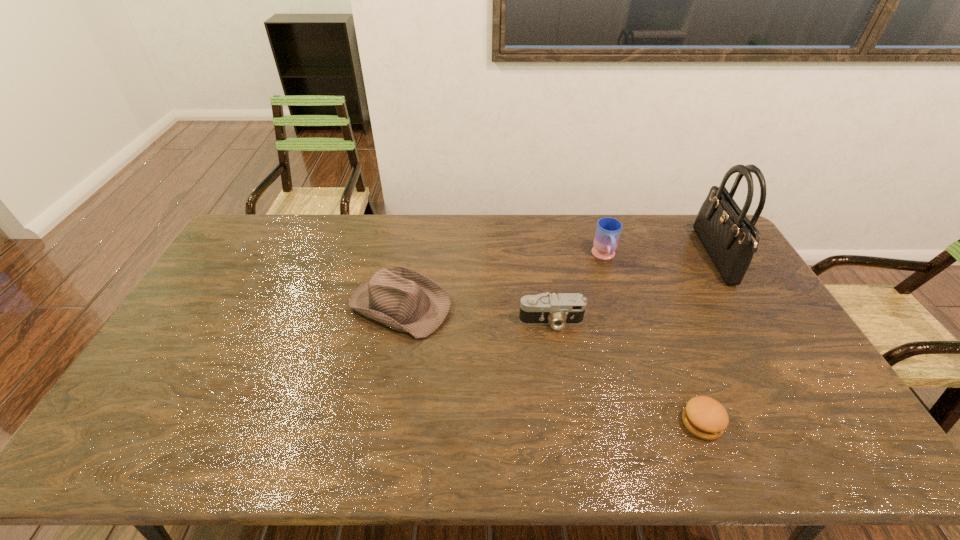
Image resolution: width=960 pixels, height=540 pixels. Find the location of `free point located 0.140m with an open clasp on the front of the handbag`. free point located 0.140m with an open clasp on the front of the handbag is located at coordinates (666, 257).

At what (x,y) coordinates should I click in order to perform the action: click on free space located 0.090m on the side of the third object from right to left with the handle. Please return your answer as a coordinate pair (x, y). Image resolution: width=960 pixels, height=540 pixels. Looking at the image, I should click on (613, 286).

Locate an element on the screen. The height and width of the screenshot is (540, 960). free space located on the back of the leftmost object is located at coordinates (410, 254).

Where is `vacant region located on the lens of the camera`? vacant region located on the lens of the camera is located at coordinates (560, 378).

I want to click on free space located 0.320m on the back of the second object from right to left, so click(x=658, y=313).

What are the coordinates of `handbag situated at the far edge` in the screenshot? It's located at (730, 238).

Where is `mug that is at the far edge`? mug that is at the far edge is located at coordinates [608, 230].

You are a GUI agent. You are given a task and a screenshot of the screen. Output one action in this format:
    pyautogui.click(x=<x>, y=<y>)
    Task: Click on the object located at the near edge
    
    Given the screenshot: What is the action you would take?
    pyautogui.click(x=704, y=417)

Locate an element on the screen. object that is at the right edge is located at coordinates (730, 238).

At what (x,y) coordinates should I click in order to perform the action: click on object that is positioned at the far right corner. Please return your answer as a coordinate pair (x, y). Looking at the image, I should click on (730, 238).